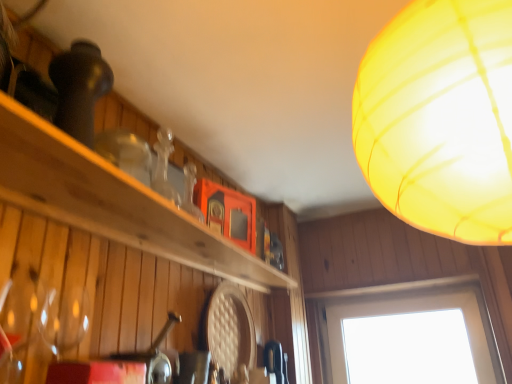
Question: Relative to wooden shelf at upper left, is translucent yellow lampshade at upper right in front or behind?

Choices:
 (A) front
 (B) behind

Answer: (A)

Question: From a real-world perspective, is translucent yellow lampshade at upper right positioned above or below wooden shelf at upper left?

Choices:
 (A) above
 (B) below

Answer: (A)

Question: Considering the real-world distances, which object is closest to the wooden shelf at upper left?

Choices:
 (A) transparent glass window at lower right
 (B) translucent yellow lampshade at upper right

Answer: (B)

Question: Which object is positioned farthest from the transparent glass window at lower right?

Choices:
 (A) translucent yellow lampshade at upper right
 (B) wooden shelf at upper left

Answer: (A)